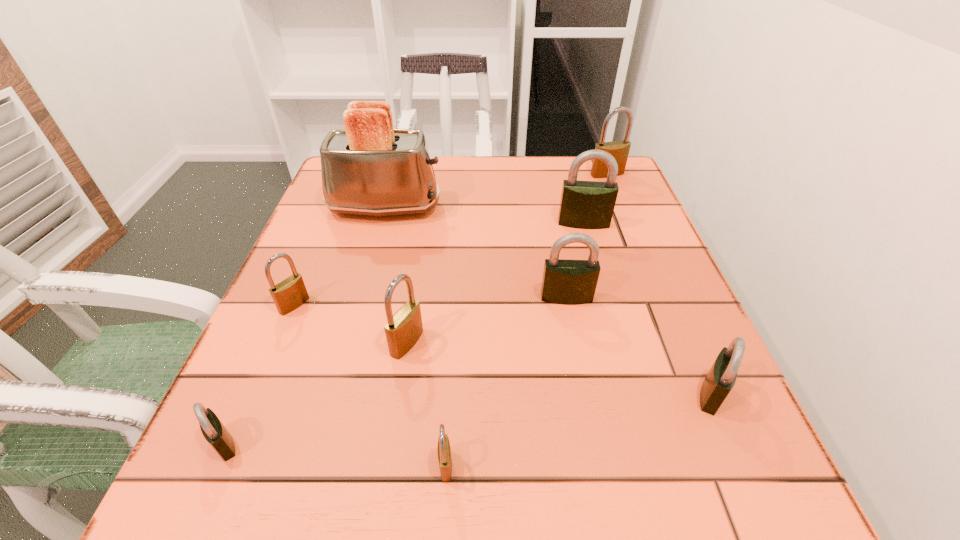
Where is `padlock that is the second nearest to the second farthest black padlock`? This screenshot has width=960, height=540. padlock that is the second nearest to the second farthest black padlock is located at coordinates (584, 204).

Find the location of a particular element. This screenshot has width=960, height=540. padlock that is the seventh closest to the second brass padlock from right to left is located at coordinates (619, 150).

Where is `the third closest black padlock to the gray toaster`? The image size is (960, 540). the third closest black padlock to the gray toaster is located at coordinates (213, 430).

I want to click on the third closest black padlock relative to the gray toaster, so click(213, 430).

Locate an element on the screen. This screenshot has width=960, height=540. brass padlock that stands as the second closest to the nearest black padlock is located at coordinates (403, 329).

Point out which brass padlock is positioned as the second nearest to the smallest black padlock. Please provide its 2D coordinates. Your answer should be formatted as a tuple, i.e. [(x, y)], where the tuple contains the x and y coordinates of a point satisfying the conditions above.

[(403, 329)]

Where is `vacant space that satisfies the following two spatial constraints: 1. on the side of the toaster with the control lever; 2. on the left side of the third biggest black padlock`? Image resolution: width=960 pixels, height=540 pixels. vacant space that satisfies the following two spatial constraints: 1. on the side of the toaster with the control lever; 2. on the left side of the third biggest black padlock is located at coordinates (333, 394).

At what (x,y) coordinates should I click in order to perform the action: click on vacant position in the image that satisfies the following two spatial constraints: 1. on the back side of the biggest black padlock; 2. on the side of the toaster with the control lever. Please return your answer as a coordinate pair (x, y). This screenshot has width=960, height=540. Looking at the image, I should click on (579, 208).

This screenshot has height=540, width=960. I want to click on free space in the image that satisfies the following two spatial constraints: 1. on the back side of the third nearest black padlock; 2. on the side of the tallest object with the control lever, so click(x=548, y=208).

Find the location of a particular element. vacant position in the image that satisfies the following two spatial constraints: 1. on the back side of the sixth farthest padlock; 2. on the side of the tallest object with the control lever is located at coordinates (630, 208).